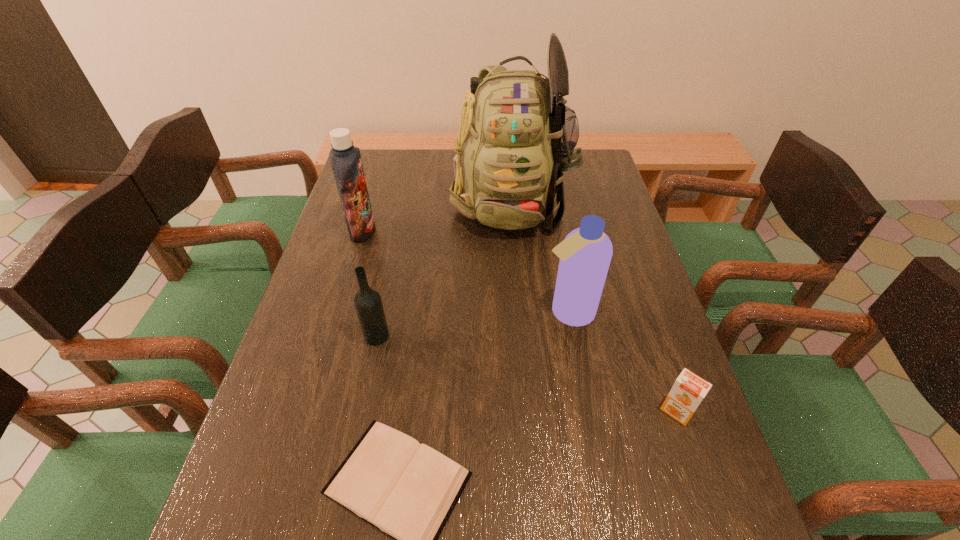
What are the coordinates of `free space located on the right of the third shortest object` in the screenshot? It's located at (493, 336).

The height and width of the screenshot is (540, 960). I want to click on free location located on the back of the second shortest object, so click(x=635, y=288).

This screenshot has width=960, height=540. What are the coordinates of `object present at the far edge` in the screenshot? It's located at (516, 137).

At what (x,y) coordinates should I click in order to perform the action: click on object situated at the left edge. Please return your answer as a coordinate pair (x, y). The height and width of the screenshot is (540, 960). Looking at the image, I should click on (345, 159).

Identify the location of backpack that is positioned at the right edge. The width and height of the screenshot is (960, 540). (516, 137).

At what (x,y) coordinates should I click in order to perform the action: click on shampoo positioned at the right edge. Please return your answer as a coordinate pair (x, y). This screenshot has height=540, width=960. Looking at the image, I should click on (585, 254).

This screenshot has width=960, height=540. Find the location of `orange juice that is at the right edge`. orange juice that is at the right edge is located at coordinates (688, 391).

The width and height of the screenshot is (960, 540). I want to click on object present at the far right corner, so click(516, 137).

Locate an element on the screen. The height and width of the screenshot is (540, 960). vacant space at the far edge of the desktop is located at coordinates (416, 150).

Identify the location of vacant area at the left edge. (x=345, y=294).